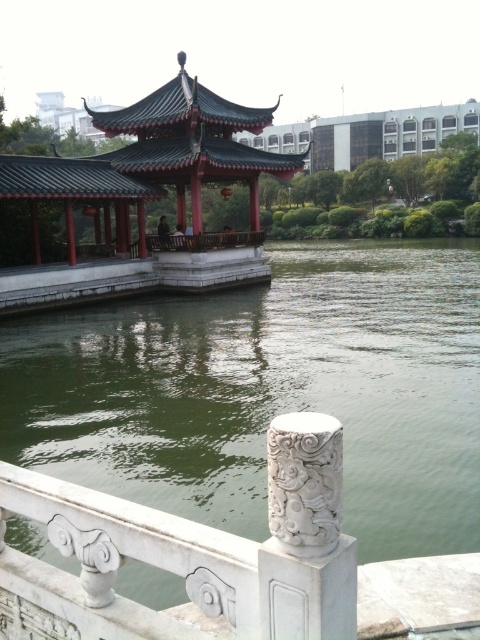
You are an architect analyzing the layout of this traditional Chinese garden. You need to determine the relative positions of the green stone water at center and the shiny red gazebo at center. Which object is positioned to the right side of the other?

The green stone water at center is to the right of the shiny red gazebo at center, so the green stone water at center is positioned to the right of the shiny red gazebo at center.

You are an architect designing a new garden layout and need to ensure that the green stone water at center and the shiny red gazebo at center are both visible from the main path. Given their sizes, which one should be placed closer to the path to ensure both are easily seen?

The green stone water at center occupies less space than the shiny red gazebo at center, so to ensure both are easily seen from the main path, the smaller green stone water at center should be placed closer to the path while the larger gazebo can be positioned slightly further back.

From the picture: You are standing at the entrance of the pavilion and want to locate the green stone water at center. According to the coordinates provided, where should you look relative to your current position?

The green stone water at center is located at coordinates point 0.613 on the x axis and 0.560 on the y axis, so you should look towards the right and slightly forward from your current position at the entrance of the pavilion.